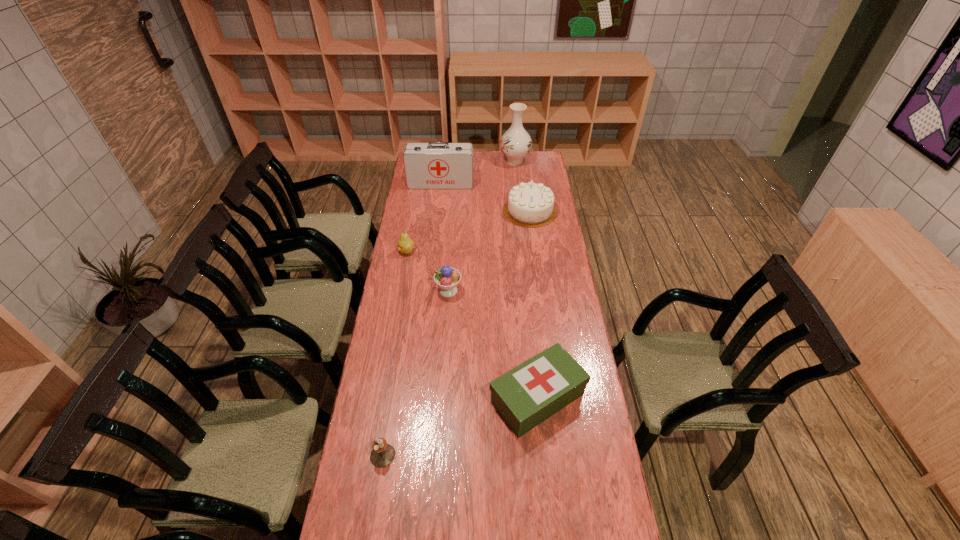
Locate an element on the screen. This screenshot has height=540, width=960. vacant space situated on the left of the farthest object is located at coordinates [x=479, y=161].

Find the location of a particular element. The width and height of the screenshot is (960, 540). free space located on the front-facing side of the sixth nearest object is located at coordinates (436, 226).

The height and width of the screenshot is (540, 960). In order to click on vacant space situated on the left of the fifth nearest object in this screenshot , I will do `click(493, 211)`.

Where is `vacant space situated 0.360m on the right of the icecream`? vacant space situated 0.360m on the right of the icecream is located at coordinates (546, 291).

What are the coordinates of `blank space located 0.270m on the front of the fourth nearest object` in the screenshot? It's located at (398, 300).

Identify the location of vacant area located on the front of the sixth farthest object. (545, 472).

Where is `vacant space located 0.250m on the right of the nearest object`? vacant space located 0.250m on the right of the nearest object is located at coordinates (475, 455).

Find the location of a particular element. object that is at the far edge is located at coordinates (516, 143).

Find the location of a particular element. The height and width of the screenshot is (540, 960). the first-aid kit located at the left edge is located at coordinates (435, 165).

This screenshot has width=960, height=540. In order to click on pear that is at the left edge in this screenshot , I will do `click(405, 245)`.